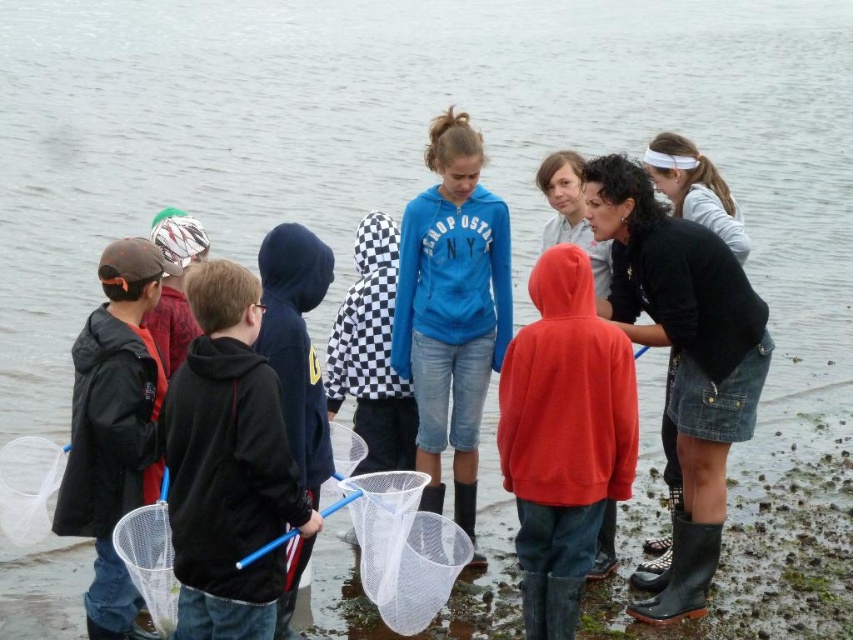
Based on the photo, which is more to the left, black fleece jacket at center or matte black jacket at left?

matte black jacket at left

Which is behind, point (221, 612) or point (126, 506)?

The point (126, 506) is behind.

Where is `black fleece jacket at center`? This screenshot has width=853, height=640. black fleece jacket at center is located at coordinates (228, 465).

Who is shorter, matte blue hoodie at center or white mesh fishing net at lower center?

white mesh fishing net at lower center

Describe the element at coordinates (451, 308) in the screenshot. Image resolution: width=853 pixels, height=640 pixels. I see `matte blue hoodie at center` at that location.

At what (x,y) coordinates should I click in order to perform the action: click on matte blue hoodie at center. Please return your answer as a coordinate pair (x, y). This screenshot has height=640, width=853. Looking at the image, I should click on (451, 308).

Is matte red hoodie at center below matte black jacket at left?

Yes.

Between matte red hoodie at center and matte black jacket at left, which one appears on the right side from the viewer's perspective?

matte red hoodie at center

Which is in front, point (556, 422) or point (135, 241)?

Point (556, 422) is more forward.

The image size is (853, 640). I want to click on matte red hoodie at center, so click(563, 436).